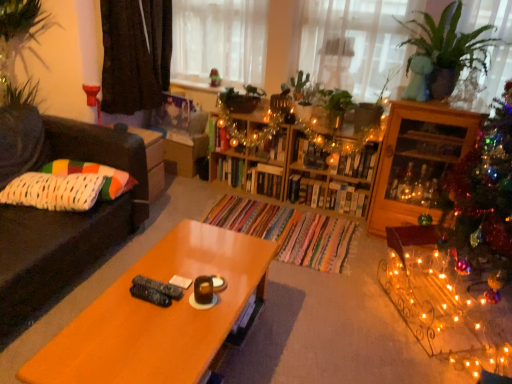
Question: Is dark brown fabric at upper left in contact with wooden bookshelf at center, positioned as the first shelf in right-to-left order?

Choices:
 (A) yes
 (B) no

Answer: (B)

Question: Is dark brown fabric at upper left positioned far away from wooden bookshelf at center, positioned as the first shelf in right-to-left order?

Choices:
 (A) no
 (B) yes

Answer: (B)

Question: Is dark brown fabric at upper left located outside wooden bookshelf at center, which is the 2th shelf from left to right?

Choices:
 (A) yes
 (B) no

Answer: (A)

Question: Does dark brown fabric at upper left have a larger size compared to wooden bookshelf at center, positioned as the first shelf in right-to-left order?

Choices:
 (A) no
 (B) yes

Answer: (B)

Question: Can you confirm if dark brown fabric at upper left is positioned to the right of wooden bookshelf at center, which is the 2th shelf from left to right?

Choices:
 (A) yes
 (B) no

Answer: (B)

Question: Does dark brown fabric at upper left have a greater height compared to wooden bookshelf at center, which is the 2th shelf from left to right?

Choices:
 (A) no
 (B) yes

Answer: (B)

Question: Would you say green glossy plant at upper right contains white knitted pillow at left, which is the 1th pillow in front-to-back order?

Choices:
 (A) yes
 (B) no

Answer: (B)

Question: Does green glossy plant at upper right have a greater width compared to white knitted pillow at left, marked as the 2th pillow in a back-to-front arrangement?

Choices:
 (A) no
 (B) yes

Answer: (B)

Question: From the image's perspective, does green glossy plant at upper right appear lower than white knitted pillow at left, marked as the 2th pillow in a back-to-front arrangement?

Choices:
 (A) yes
 (B) no

Answer: (B)

Question: Is green glossy plant at upper right closer to the viewer compared to white knitted pillow at left, marked as the 2th pillow in a back-to-front arrangement?

Choices:
 (A) no
 (B) yes

Answer: (B)

Question: From a real-world perspective, is green glossy plant at upper right located higher than white knitted pillow at left, which is the 1th pillow in front-to-back order?

Choices:
 (A) no
 (B) yes

Answer: (B)

Question: Can you confirm if green glossy plant at upper right is smaller than white knitted pillow at left, marked as the 2th pillow in a back-to-front arrangement?

Choices:
 (A) no
 (B) yes

Answer: (A)

Question: Is wooden bookshelf at center located outside green leafy plant at center?

Choices:
 (A) no
 (B) yes

Answer: (B)